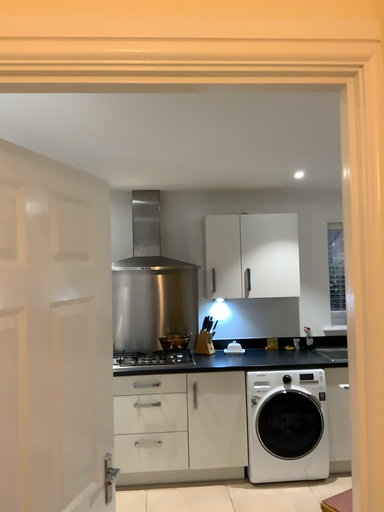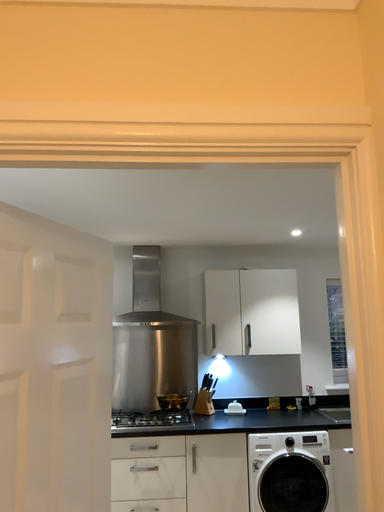
Question: Which way did the camera rotate in the video?

Choices:
 (A) rotated downward
 (B) rotated upward

Answer: (B)